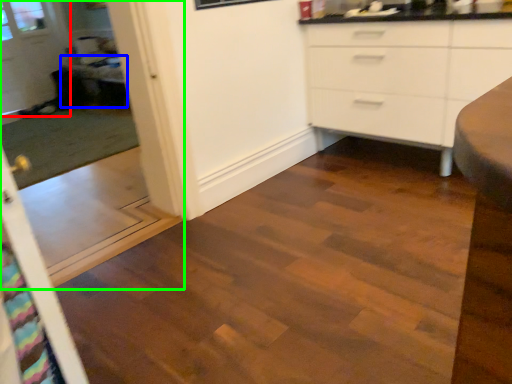
Question: Which object is positioned farthest from glass door (highlighted by a red box)? Select from table (highlighted by a blue box) and screen door (highlighted by a green box).

Choices:
 (A) table
 (B) screen door

Answer: (A)